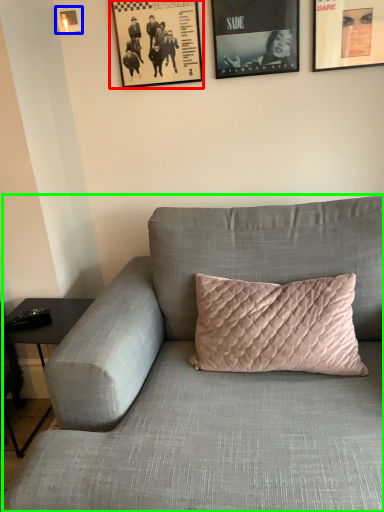
Question: Which object is the farthest from picture frame (highlighted by a red box)? Choose among these: picture frame (highlighted by a blue box) or studio couch (highlighted by a green box).

Choices:
 (A) picture frame
 (B) studio couch

Answer: (B)